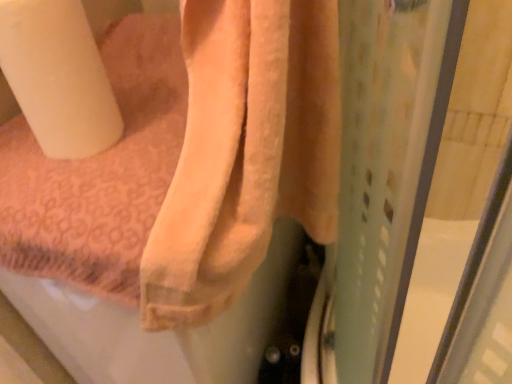
Question: From a real-world perspective, is white matte toilet paper at left located beneath orange terry towel at upper center?

Choices:
 (A) yes
 (B) no

Answer: (B)

Question: Does white matte toilet paper at left have a lesser height compared to orange terry towel at upper center?

Choices:
 (A) yes
 (B) no

Answer: (A)

Question: Is white matte toilet paper at left positioned in front of orange terry towel at upper center?

Choices:
 (A) yes
 (B) no

Answer: (B)

Question: Is white matte toilet paper at left facing away from orange terry towel at upper center?

Choices:
 (A) no
 (B) yes

Answer: (A)

Question: Considering the relative positions of white matte toilet paper at left and orange terry towel at upper center in the image provided, is white matte toilet paper at left behind orange terry towel at upper center?

Choices:
 (A) yes
 (B) no

Answer: (A)

Question: Considering the relative positions of white matte toilet paper at left and orange terry towel at upper center in the image provided, is white matte toilet paper at left to the right of orange terry towel at upper center from the viewer's perspective?

Choices:
 (A) no
 (B) yes

Answer: (A)

Question: Is orange terry towel at upper center at the right side of white matte toilet paper at left?

Choices:
 (A) no
 (B) yes

Answer: (B)

Question: Considering the relative sizes of orange terry towel at upper center and white matte toilet paper at left in the image provided, is orange terry towel at upper center shorter than white matte toilet paper at left?

Choices:
 (A) yes
 (B) no

Answer: (B)

Question: Does orange terry towel at upper center have a smaller size compared to white matte toilet paper at left?

Choices:
 (A) yes
 (B) no

Answer: (B)

Question: Is orange terry towel at upper center not close to white matte toilet paper at left?

Choices:
 (A) yes
 (B) no

Answer: (B)

Question: Considering the relative sizes of orange terry towel at upper center and white matte toilet paper at left in the image provided, is orange terry towel at upper center taller than white matte toilet paper at left?

Choices:
 (A) no
 (B) yes

Answer: (B)

Question: From the image's perspective, is orange terry towel at upper center located above white matte toilet paper at left?

Choices:
 (A) yes
 (B) no

Answer: (B)

Question: Looking at the image, does orange terry towel at upper center seem bigger or smaller compared to white matte toilet paper at left?

Choices:
 (A) small
 (B) big

Answer: (B)